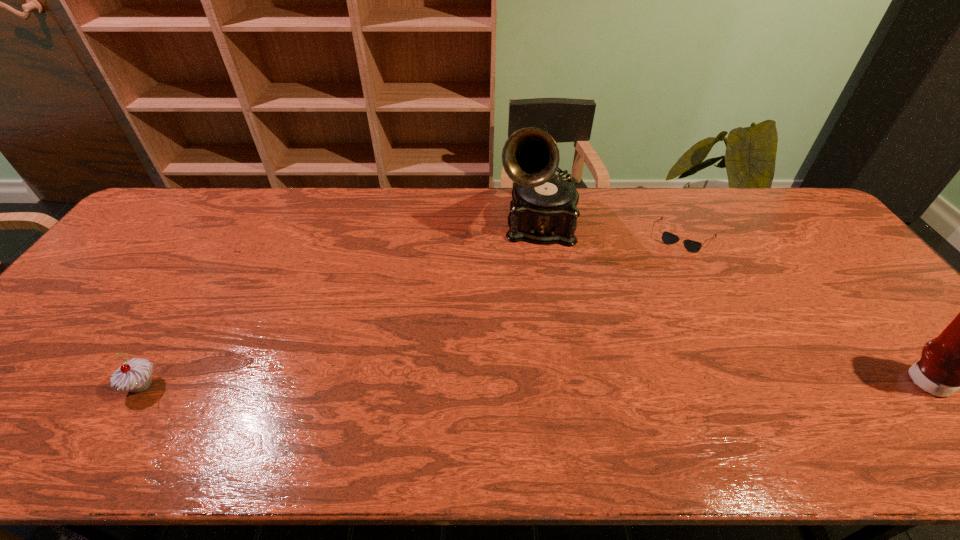
Find the location of a particular element. vacant space on the desktop that is between the cupcake and the third shortest object and is positioned on the lenses of the sunglasses is located at coordinates (619, 382).

You are a GUI agent. You are given a task and a screenshot of the screen. Output one action in this format:
    pyautogui.click(x=<x>, y=<y>)
    Task: Click on the vacant space on the desktop that is between the cupcake and the rightmost object and is positioned on the horn of the second object from left to right
    The height and width of the screenshot is (540, 960).
    Given the screenshot: What is the action you would take?
    pyautogui.click(x=531, y=383)